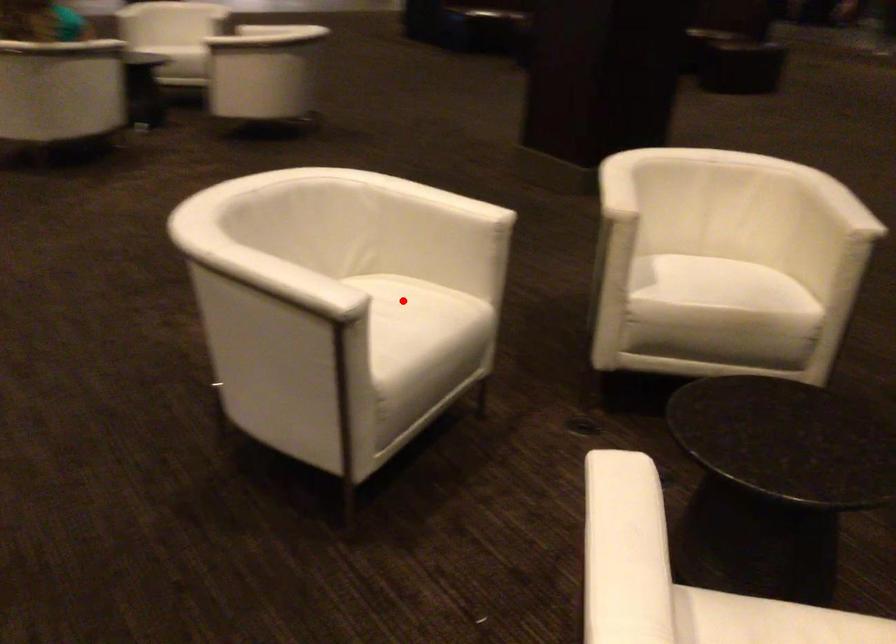
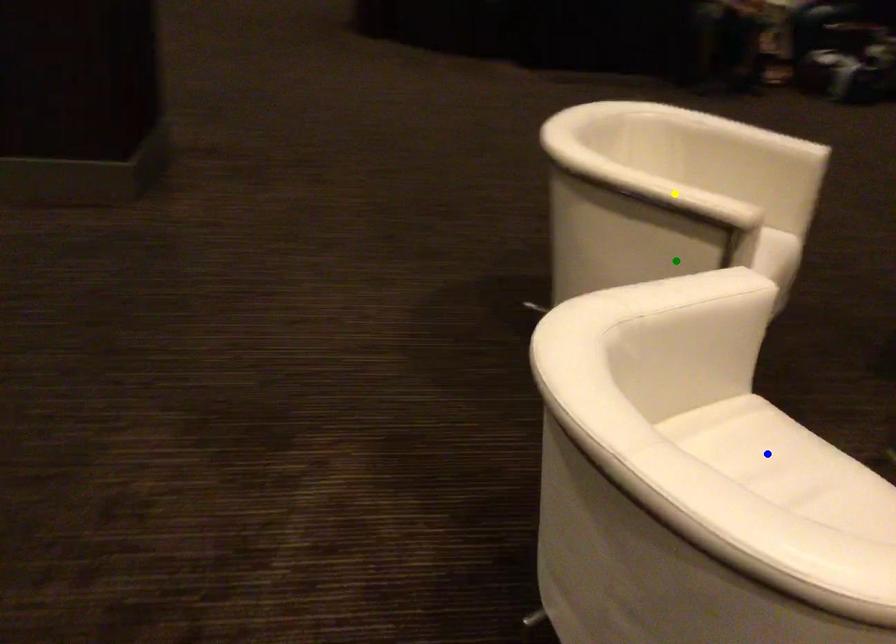
Question: I am providing you with two images of the same scene from different viewpoints. A red point is marked on the first image. You are given multiple points on the second image. Can you choose the point in image 2 that corresponds to the point in image 1?

Choices:
 (A) blue point
 (B) yellow point
 (C) green point

Answer: (A)